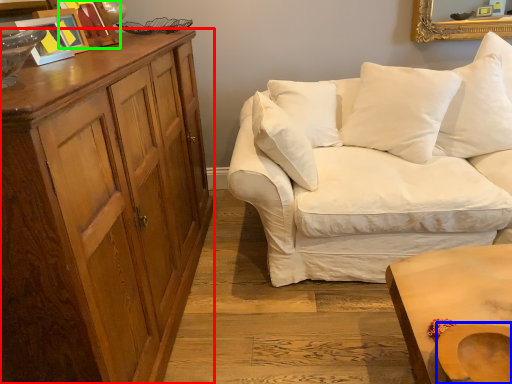
Question: Which object is positioned closest to cabinetry (highlighted by a red box)? Select from swivel chair (highlighted by a blue box) and picture frame (highlighted by a green box).

Choices:
 (A) swivel chair
 (B) picture frame

Answer: (B)